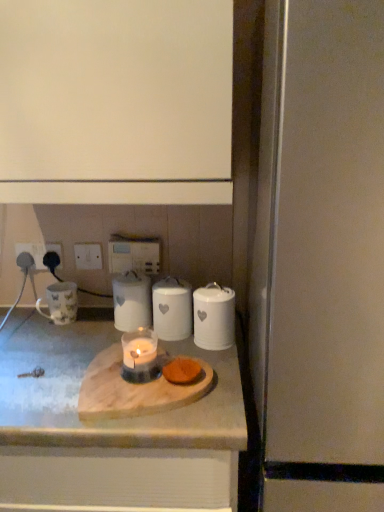
What do you see at coordinates (172, 309) in the screenshot?
I see `white ceramic jar at center, which is the 3th appliance in left-to-right order` at bounding box center [172, 309].

What do you see at coordinates (214, 317) in the screenshot? I see `white ceramic jar at right, the fourth appliance in the left-to-right sequence` at bounding box center [214, 317].

The width and height of the screenshot is (384, 512). Describe the element at coordinates (132, 301) in the screenshot. I see `white ceramic candle at center, which appears as the 4th appliance when viewed from the right` at that location.

Where is `white plastic electric outlet at lower left, which is the 1th electric outlet in left-to-right order`? white plastic electric outlet at lower left, which is the 1th electric outlet in left-to-right order is located at coordinates (33, 252).

Based on the photo, in order to face white glossy mug at left, which appears as the 5th appliance when viewed from the right, should I rotate leftwards or rightwards?

You should rotate left by 17.435 degrees.

This screenshot has width=384, height=512. What do you see at coordinates (60, 303) in the screenshot?
I see `white glossy mug at left, which is counted as the first appliance, starting from the left` at bounding box center [60, 303].

At what (x,y) coordinates should I click in order to perform the action: click on white marble countertop at center. Please return your answer as a coordinate pair (x, y). Looking at the image, I should click on (110, 428).

Is translucent glass candle at center positioned with its back to orange sponge at center?

No, translucent glass candle at center's orientation is not away from orange sponge at center.

Which is farther from the camera, (135, 352) or (175, 359)?

The point (175, 359) is more distant.

Does translucent glass candle at center have a greater height compared to orange sponge at center?

Yes.

From the image's perspective, which is above, white plastic switch at upper center, acting as the 3th electric outlet starting from the left, or white plastic electric outlet at lower left, which is the 1th electric outlet in left-to-right order?

white plastic electric outlet at lower left, which is the 1th electric outlet in left-to-right order.

Considering the sizes of white plastic switch at upper center, the 1th electric outlet viewed from the right, and white plastic electric outlet at lower left, which appears as the 3th electric outlet when viewed from the right, in the image, is white plastic switch at upper center, the 1th electric outlet viewed from the right, wider or thinner than white plastic electric outlet at lower left, which appears as the 3th electric outlet when viewed from the right,?

Clearly, white plastic switch at upper center, the 1th electric outlet viewed from the right, has less width compared to white plastic electric outlet at lower left, which appears as the 3th electric outlet when viewed from the right.

Does white plastic switch at upper center, the 1th electric outlet viewed from the right, contain white plastic electric outlet at lower left, which is the 1th electric outlet in left-to-right order?

No, white plastic electric outlet at lower left, which is the 1th electric outlet in left-to-right order, is located outside of white plastic switch at upper center, the 1th electric outlet viewed from the right.

Is white plastic switch at upper center, the 1th electric outlet viewed from the right, next to white plastic electric outlet at lower left, which is the 1th electric outlet in left-to-right order?

No, white plastic switch at upper center, the 1th electric outlet viewed from the right, is not in contact with white plastic electric outlet at lower left, which is the 1th electric outlet in left-to-right order.

Considering the sizes of objects white ceramic jar at right, the second appliance when ordered from right to left, and translucent glass candle at center in the image provided, who is wider, white ceramic jar at right, the second appliance when ordered from right to left, or translucent glass candle at center?

With larger width is white ceramic jar at right, the second appliance when ordered from right to left.

From a real-world perspective, does white ceramic jar at right, the second appliance when ordered from right to left, sit lower than translucent glass candle at center?

No.

Is white ceramic jar at right, the second appliance when ordered from right to left, taller or shorter than translucent glass candle at center?

Considering their sizes, white ceramic jar at right, the second appliance when ordered from right to left, has more height than translucent glass candle at center.

Do you think white ceramic jar at right, the fourth appliance in the left-to-right sequence, is within translucent glass candle at center, or outside of it?

white ceramic jar at right, the fourth appliance in the left-to-right sequence, is not enclosed by translucent glass candle at center.

Is the position of white ceramic jar at right, the second appliance when ordered from right to left, less distant than that of white ceramic jar at center, the 3th appliance in the right-to-left sequence?

That is True.

Which of these two, white ceramic jar at right, the second appliance when ordered from right to left, or white ceramic jar at center, the 3th appliance in the right-to-left sequence, is bigger?

Bigger between the two is white ceramic jar at center, the 3th appliance in the right-to-left sequence.

Is white ceramic jar at right, the fourth appliance in the left-to-right sequence, beside white ceramic jar at center, the 3th appliance in the right-to-left sequence?

Yes, white ceramic jar at right, the fourth appliance in the left-to-right sequence, is right next to white ceramic jar at center, the 3th appliance in the right-to-left sequence, and making contact.

Considering the sizes of white ceramic jar at center, the 3th appliance in the right-to-left sequence, and satin silver fridge at right, placed as the fifth appliance when sorted from left to right, in the image, is white ceramic jar at center, the 3th appliance in the right-to-left sequence, wider or thinner than satin silver fridge at right, placed as the fifth appliance when sorted from left to right,?

In the image, white ceramic jar at center, the 3th appliance in the right-to-left sequence, appears to be more narrow than satin silver fridge at right, placed as the fifth appliance when sorted from left to right.

Is point (186, 305) positioned before point (309, 209)?

No.

Find the location of `appliance that is the 2nd one when counting backward from the satin silver fridge at right, placed as the fifth appliance when sorted from left to right`. appliance that is the 2nd one when counting backward from the satin silver fridge at right, placed as the fifth appliance when sorted from left to right is located at coordinates (172, 309).

From the image's perspective, does white ceramic jar at center, which is the 3th appliance in left-to-right order, appear higher than satin silver fridge at right, the 1th appliance positioned from the right?

Yes, from the image's perspective, white ceramic jar at center, which is the 3th appliance in left-to-right order, is on top of satin silver fridge at right, the 1th appliance positioned from the right.

Where is `food behind the white matte cabinet at upper center`? food behind the white matte cabinet at upper center is located at coordinates (182, 371).

Which object is closer to the camera taking this photo, orange sponge at center or white matte cabinet at upper center?

white matte cabinet at upper center is closer to the camera.

Is orange sponge at center directly adjacent to white matte cabinet at upper center?

No, orange sponge at center is not beside white matte cabinet at upper center.

Is orange sponge at center at the right side of white matte cabinet at upper center?

Correct, you'll find orange sponge at center to the right of white matte cabinet at upper center.

From a real-world perspective, is white ceramic jar at right, the fourth appliance in the left-to-right sequence, on top of white plastic electric outlet at lower left, positioned as the 2th electric outlet in left-to-right order?

Actually, white ceramic jar at right, the fourth appliance in the left-to-right sequence, is physically below white plastic electric outlet at lower left, positioned as the 2th electric outlet in left-to-right order, in the real world.

Can you confirm if white ceramic jar at right, the second appliance when ordered from right to left, is shorter than white plastic electric outlet at lower left, which is the second electric outlet from right to left?

Incorrect, the height of white ceramic jar at right, the second appliance when ordered from right to left, does not fall short of that of white plastic electric outlet at lower left, which is the second electric outlet from right to left.

Which object is closer to the camera, white ceramic jar at right, the second appliance when ordered from right to left, or white plastic electric outlet at lower left, which is the second electric outlet from right to left?

white ceramic jar at right, the second appliance when ordered from right to left, is more forward.

Image resolution: width=384 pixels, height=512 pixels. What are the coordinates of `candle holder behind the orange sponge at center` in the screenshot? It's located at (140, 356).

At what (x,y) coordinates should I click in order to perform the action: click on electric outlet that is the 1st one when counting downward from the white plastic electric outlet at lower left, which appears as the 3th electric outlet when viewed from the right (from the image's perspective). Please return your answer as a coordinate pair (x, y). Image resolution: width=384 pixels, height=512 pixels. Looking at the image, I should click on (88, 256).

Looking at the image, which one is located closer to satin silver fridge at right, placed as the fifth appliance when sorted from left to right, white plastic switch at upper center, acting as the 3th electric outlet starting from the left, or white ceramic candle at center, which is the 2th appliance in left-to-right order?

The object closer to satin silver fridge at right, placed as the fifth appliance when sorted from left to right, is white ceramic candle at center, which is the 2th appliance in left-to-right order.

When comparing their distances from white plastic electric outlet at lower left, which is the second electric outlet from right to left, does satin silver fridge at right, the 1th appliance positioned from the right, or white matte cabinet at upper center seem further?

satin silver fridge at right, the 1th appliance positioned from the right, lies further to white plastic electric outlet at lower left, which is the second electric outlet from right to left, than the other object.

Considering their positions, is white plastic switch at upper center, the 1th electric outlet viewed from the right, positioned further to white matte cabinet at upper center than white glossy mug at left, which is counted as the first appliance, starting from the left?

The object further to white matte cabinet at upper center is white glossy mug at left, which is counted as the first appliance, starting from the left.

When comparing their distances from white marble countertop at center, does white ceramic jar at right, the fourth appliance in the left-to-right sequence, or white ceramic jar at center, the 3th appliance in the right-to-left sequence, seem further?

white ceramic jar at right, the fourth appliance in the left-to-right sequence.

From the image, which object appears to be nearer to white plastic electric outlet at lower left, which is the second electric outlet from right to left, white ceramic jar at center, the 3th appliance in the right-to-left sequence, or white marble countertop at center?

Based on the image, white ceramic jar at center, the 3th appliance in the right-to-left sequence, appears to be nearer to white plastic electric outlet at lower left, which is the second electric outlet from right to left.

Looking at the image, which one is located closer to white ceramic candle at center, which appears as the 4th appliance when viewed from the right, translucent glass candle at center or white plastic switch at upper center, acting as the 3th electric outlet starting from the left?

Among the two, translucent glass candle at center is located nearer to white ceramic candle at center, which appears as the 4th appliance when viewed from the right.

Which object lies further to the anchor point white plastic electric outlet at lower left, positioned as the 2th electric outlet in left-to-right order, white glossy mug at left, which appears as the 5th appliance when viewed from the right, or white plastic electric outlet at lower left, which is the 1th electric outlet in left-to-right order?

Among the two, white glossy mug at left, which appears as the 5th appliance when viewed from the right, is located further to white plastic electric outlet at lower left, positioned as the 2th electric outlet in left-to-right order.

Based on their spatial positions, is white ceramic jar at right, the second appliance when ordered from right to left, or satin silver fridge at right, placed as the fifth appliance when sorted from left to right, closer to white plastic electric outlet at lower left, which is the second electric outlet from right to left?

white ceramic jar at right, the second appliance when ordered from right to left, is positioned closer to the anchor white plastic electric outlet at lower left, which is the second electric outlet from right to left.

At what (x,y) coordinates should I click in order to perform the action: click on candle holder situated between white plastic electric outlet at lower left, which is the 1th electric outlet in left-to-right order, and satin silver fridge at right, placed as the fifth appliance when sorted from left to right, from left to right. Please return your answer as a coordinate pair (x, y). Image resolution: width=384 pixels, height=512 pixels. Looking at the image, I should click on (140, 356).

I want to click on electric outlet located between white plastic electric outlet at lower left, positioned as the 2th electric outlet in left-to-right order, and white ceramic jar at right, the second appliance when ordered from right to left, in the left-right direction, so click(x=88, y=256).

This screenshot has width=384, height=512. In order to click on appliance between translucent glass candle at center and white ceramic jar at center, which is the 3th appliance in left-to-right order, in the front-back direction in this screenshot , I will do `click(214, 317)`.

Find the location of `appliance positioned between satin silver fridge at right, the 1th appliance positioned from the right, and white ceramic jar at center, which is the 3th appliance in left-to-right order, from near to far`. appliance positioned between satin silver fridge at right, the 1th appliance positioned from the right, and white ceramic jar at center, which is the 3th appliance in left-to-right order, from near to far is located at coordinates (214, 317).